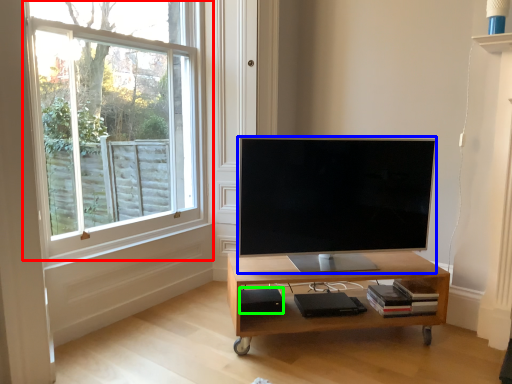
Question: Which object is the farthest from window (highlighted by a red box)? Choose among these: television (highlighted by a blue box) or speaker (highlighted by a green box).

Choices:
 (A) television
 (B) speaker

Answer: (B)